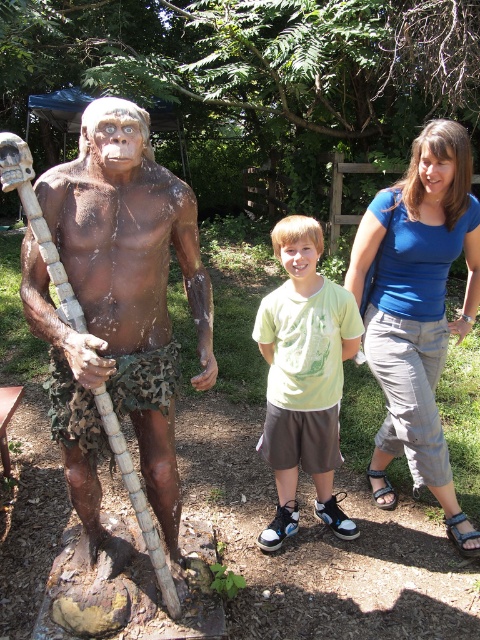
You are standing in the park and want to take a photo of both the brown matte statue at left and the green cotton shirt at center. Since the statue is closer to you, will you need to adjust your camera to focus on both objects at the same time?

The brown matte statue at left is closer to the viewer than the green cotton shirt at center. To focus on both, ensure your camera has a wide enough depth of field to capture both distances clearly.

You are standing in the park and want to take a photo of the brown matte statue at left. What are the coordinates where you should aim your camera?

You should aim your camera at point (118, 307) to capture the brown matte statue at left.